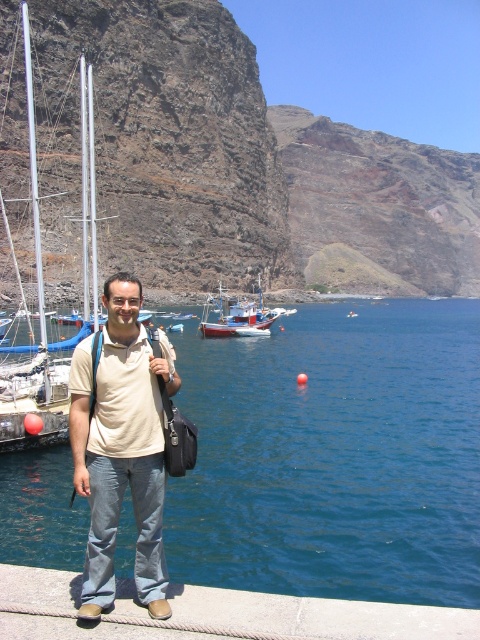
Is blue water at lower center thinner than concrete at lower center?

Incorrect, blue water at lower center's width is not less than concrete at lower center's.

Can you confirm if blue water at lower center is positioned to the left of concrete at lower center?

Incorrect, blue water at lower center is not on the left side of concrete at lower center.

Between point (326, 588) and point (297, 596), which one is positioned in front?

Point (297, 596)

Locate an element on the screen. This screenshot has height=640, width=480. blue water at lower center is located at coordinates tap(335, 456).

Find the location of `blue water at lower center`. blue water at lower center is located at coordinates (335, 456).

Is blue water at lower center wider than wooden fishing boat at center?

Yes, blue water at lower center is wider than wooden fishing boat at center.

Where is `blue water at lower center`? Image resolution: width=480 pixels, height=640 pixels. blue water at lower center is located at coordinates (335, 456).

This screenshot has height=640, width=480. What do you see at coordinates (121, 448) in the screenshot? I see `light beige cotton shirt at center` at bounding box center [121, 448].

Can you confirm if light beige cotton shirt at center is thinner than brushed metal boat at left?

Yes, light beige cotton shirt at center is thinner than brushed metal boat at left.

Is point (98, 460) in front of point (36, 152)?

Yes, it is in front of point (36, 152).

Find the location of a particular element. Image resolution: width=480 pixels, height=640 pixels. light beige cotton shirt at center is located at coordinates (121, 448).